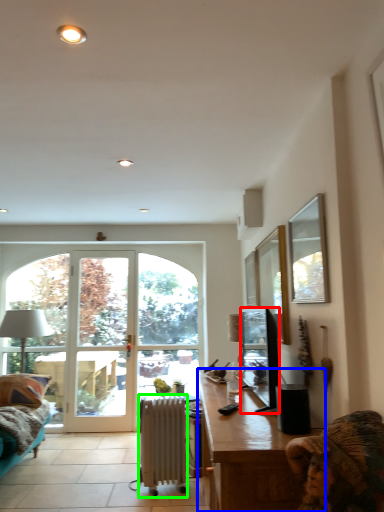
Question: Which object is the closest to the television (highlighted by a red box)? Choose among these: desk (highlighted by a blue box) or radiator (highlighted by a green box).

Choices:
 (A) desk
 (B) radiator

Answer: (A)